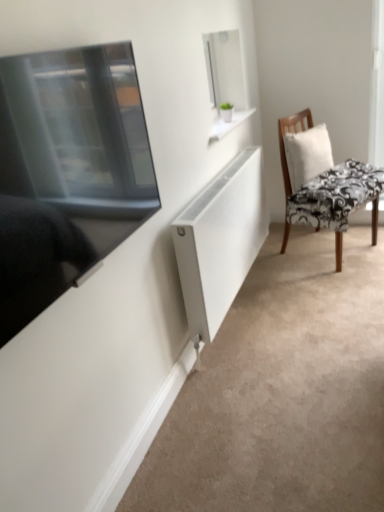
Measure the distance between point (250, 180) and camera.

A distance of 2.40 meters exists between point (250, 180) and camera.

What is the approximate height of white fabric pillow at right?

white fabric pillow at right is 15.65 inches in height.

I want to click on matte black tv at left, so click(80, 131).

The height and width of the screenshot is (512, 384). Describe the element at coordinates (80, 131) in the screenshot. I see `matte black tv at left` at that location.

Image resolution: width=384 pixels, height=512 pixels. What are the coordinates of `white matte radiator at center` in the screenshot? It's located at (220, 241).

Choose the correct answer: Is matte black tv at left inside white fabric pillow at right or outside it?

matte black tv at left exists outside the volume of white fabric pillow at right.

From the image's perspective, is matte black tv at left positioned above or below white fabric pillow at right?

From the image's perspective, matte black tv at left appears below white fabric pillow at right.

Can you confirm if matte black tv at left is smaller than white fabric pillow at right?

Actually, matte black tv at left might be larger than white fabric pillow at right.

In the image, is matte black tv at left positioned in front of or behind white fabric pillow at right?

Clearly, matte black tv at left is in front of white fabric pillow at right.

Between white fabric pillow at right and matte black tv at left, which one appears on the right side from the viewer's perspective?

From the viewer's perspective, white fabric pillow at right appears more on the right side.

Is white fabric pillow at right far from matte black tv at left?

Yes, white fabric pillow at right is far from matte black tv at left.

From the image's perspective, is white fabric pillow at right located beneath matte black tv at left?

No.

Based on the photo, from a real-world perspective, is white fabric pillow at right positioned over matte black tv at left based on gravity?

No.

Based on the photo, considering the sizes of objects white matte radiator at center and white fabric pillow at right in the image provided, who is thinner, white matte radiator at center or white fabric pillow at right?

white fabric pillow at right.

You are a GUI agent. You are given a task and a screenshot of the screen. Output one action in this format:
    pyautogui.click(x=<x>, y=<y>)
    Task: Click on the cabinet on the left of white fabric pillow at right
    Image resolution: width=384 pixels, height=512 pixels.
    Given the screenshot: What is the action you would take?
    pyautogui.click(x=220, y=241)

Is white matte radiator at center outside of white fabric pillow at right?

Absolutely, white matte radiator at center is external to white fabric pillow at right.

Is matte black tv at left closer to the viewer compared to white matte radiator at center?

Yes, matte black tv at left is closer to the camera.

Who is taller, matte black tv at left or white matte radiator at center?

With more height is white matte radiator at center.

Is white matte radiator at center inside matte black tv at left?

Actually, white matte radiator at center is outside matte black tv at left.

Is black floral fabric chair at right at the back of white fabric pillow at right?

Yes, white fabric pillow at right is positioned with its back facing black floral fabric chair at right.

From a real-world perspective, is white fabric pillow at right positioned over black floral fabric chair at right based on gravity?

Yes, from a real-world perspective, white fabric pillow at right is above black floral fabric chair at right.

Image resolution: width=384 pixels, height=512 pixels. Identify the location of pillow above the black floral fabric chair at right (from a real-world perspective). (307, 155).

Which is behind, white fabric pillow at right or black floral fabric chair at right?

white fabric pillow at right is further from the camera.

Which is more to the right, matte black tv at left or black floral fabric chair at right?

black floral fabric chair at right.

Based on the photo, is matte black tv at left spatially inside black floral fabric chair at right, or outside of it?

matte black tv at left is not enclosed by black floral fabric chair at right.

Who is bigger, matte black tv at left or black floral fabric chair at right?

With larger size is black floral fabric chair at right.

Is black floral fabric chair at right to the left of white matte radiator at center from the viewer's perspective?

In fact, black floral fabric chair at right is to the right of white matte radiator at center.

How different are the orientations of black floral fabric chair at right and white matte radiator at center in degrees?

black floral fabric chair at right and white matte radiator at center are facing 25.7 degrees away from each other.

Is point (281, 149) in front of point (191, 225)?

No, it is behind (191, 225).

From a real-world perspective, which is physically above, black floral fabric chair at right or white matte radiator at center?

In real-world perspective, black floral fabric chair at right is above.

This screenshot has width=384, height=512. In order to click on window screen located on the left of white fabric pillow at right in this screenshot , I will do [80, 131].

This screenshot has height=512, width=384. What are the coordinates of `window screen above the white fabric pillow at right (from a real-world perspective)` in the screenshot? It's located at (80, 131).

Which object lies nearer to the anchor point matte black tv at left, white matte radiator at center or white fabric pillow at right?

Among the two, white matte radiator at center is located nearer to matte black tv at left.

Based on their spatial positions, is matte black tv at left or black floral fabric chair at right closer to white matte radiator at center?

black floral fabric chair at right lies closer to white matte radiator at center than the other object.

Based on their spatial positions, is black floral fabric chair at right or white fabric pillow at right closer to matte black tv at left?

Based on the image, black floral fabric chair at right appears to be nearer to matte black tv at left.

Looking at the image, which one is located closer to white fabric pillow at right, black floral fabric chair at right or white matte radiator at center?

black floral fabric chair at right.

When comparing their distances from white fabric pillow at right, does black floral fabric chair at right or matte black tv at left seem closer?

Among the two, black floral fabric chair at right is located nearer to white fabric pillow at right.

Based on their spatial positions, is white matte radiator at center or white fabric pillow at right further from black floral fabric chair at right?

white matte radiator at center is further to black floral fabric chair at right.

Considering their positions, is matte black tv at left positioned closer to white fabric pillow at right than white matte radiator at center?

white matte radiator at center is positioned closer to the anchor white fabric pillow at right.

Looking at the image, which one is located closer to black floral fabric chair at right, matte black tv at left or white matte radiator at center?

Among the two, white matte radiator at center is located nearer to black floral fabric chair at right.

What are the coordinates of `cabinet positioned between matte black tv at left and black floral fabric chair at right from near to far` in the screenshot? It's located at (220, 241).

The width and height of the screenshot is (384, 512). What are the coordinates of `chair between white matte radiator at center and white fabric pillow at right in the front-back direction` in the screenshot? It's located at (328, 191).

Find the location of a particular element. cabinet between matte black tv at left and white fabric pillow at right from front to back is located at coordinates (220, 241).

The height and width of the screenshot is (512, 384). What are the coordinates of `chair between matte black tv at left and white fabric pillow at right along the z-axis` in the screenshot? It's located at (328, 191).